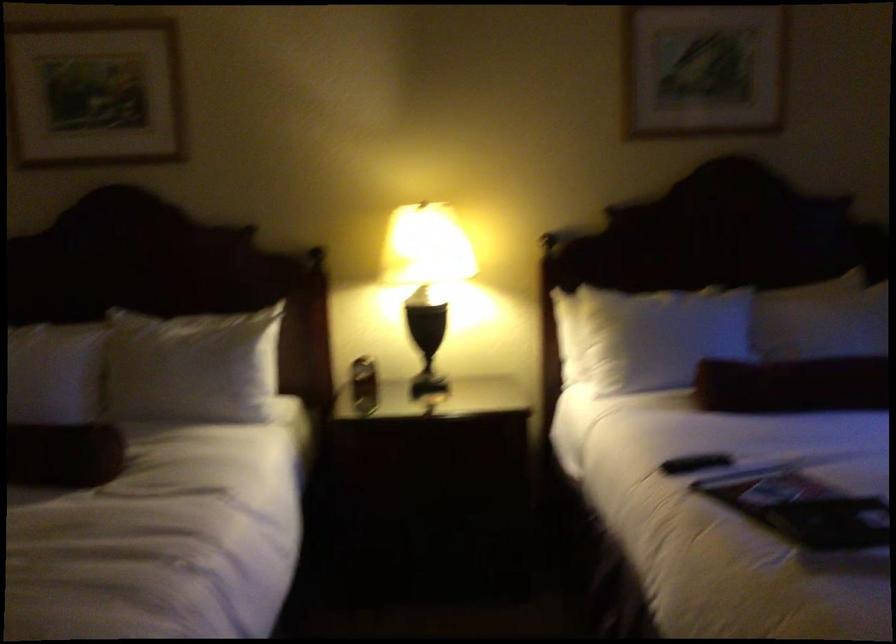
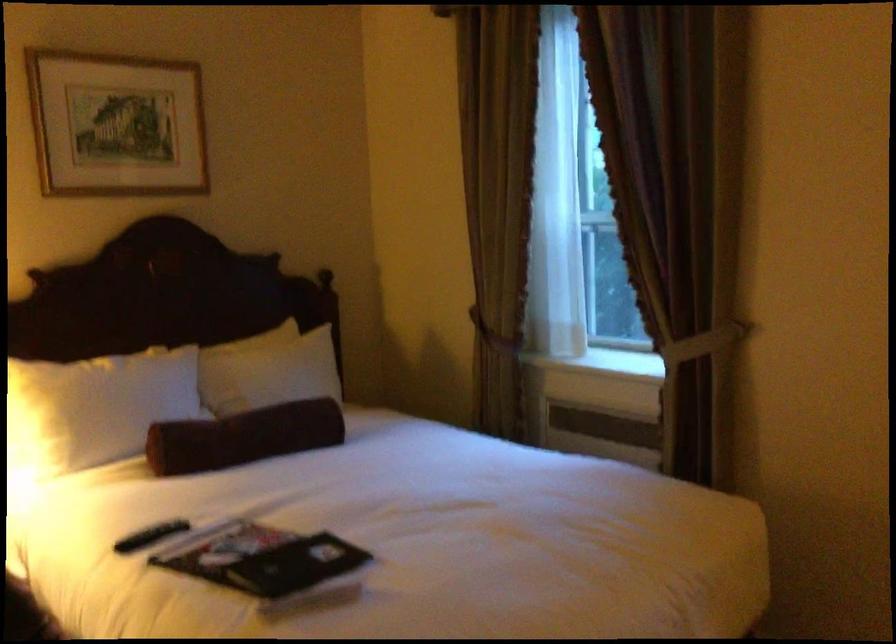
Where in the second image is the point corresponding to the point at 698,462 from the first image?

(151, 536)